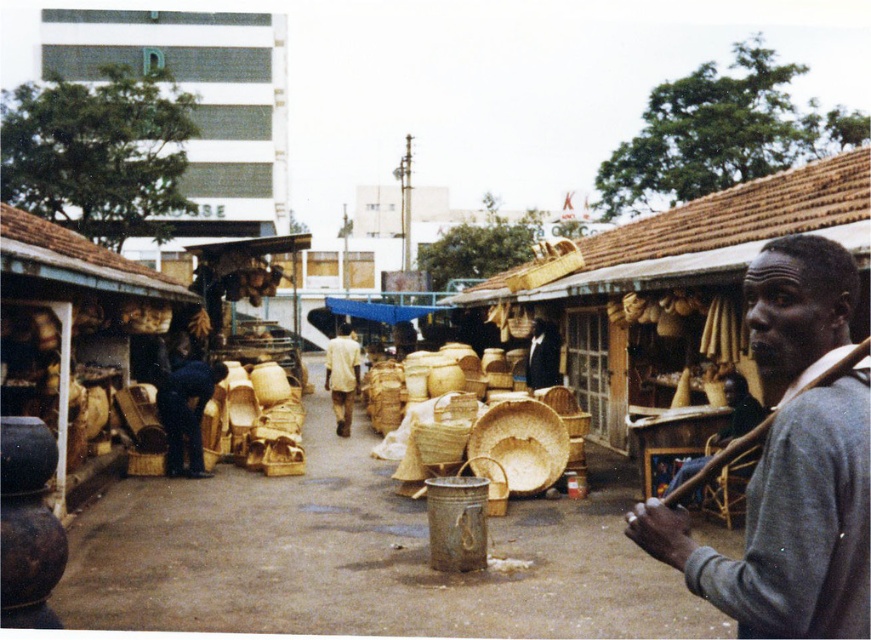
Which is in front, point (350, 394) or point (508, 280)?

Point (350, 394)

Which is more to the right, light brown woven basket at center or natural woven basket at center?

Positioned to the right is natural woven basket at center.

At what (x,y) coordinates should I click in order to perform the action: click on light brown woven basket at center. Please return your answer as a coordinate pair (x, y). Looking at the image, I should click on (342, 376).

Measure the distance from gray wool sweater at center to dark gray sweater at right.

21.97 feet

Is point (820, 330) positioned before point (727, 394)?

Yes, it is in front of point (727, 394).

Locate an element on the screen. This screenshot has height=640, width=871. gray wool sweater at center is located at coordinates (791, 461).

Can you confirm if dark blue jeans at lower left is positioned below dark gray sweater at right?

Incorrect, dark blue jeans at lower left is not positioned below dark gray sweater at right.

Can you confirm if dark blue jeans at lower left is thinner than dark gray sweater at right?

Indeed, dark blue jeans at lower left has a lesser width compared to dark gray sweater at right.

Is point (170, 474) positioned after point (693, 472)?

Yes.

Identify the location of dark blue jeans at lower left. (186, 408).